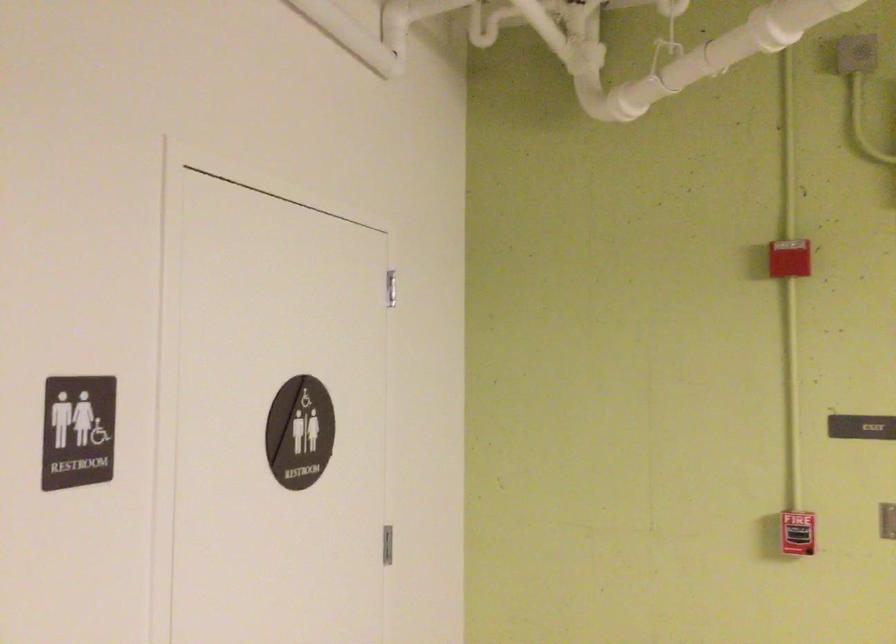
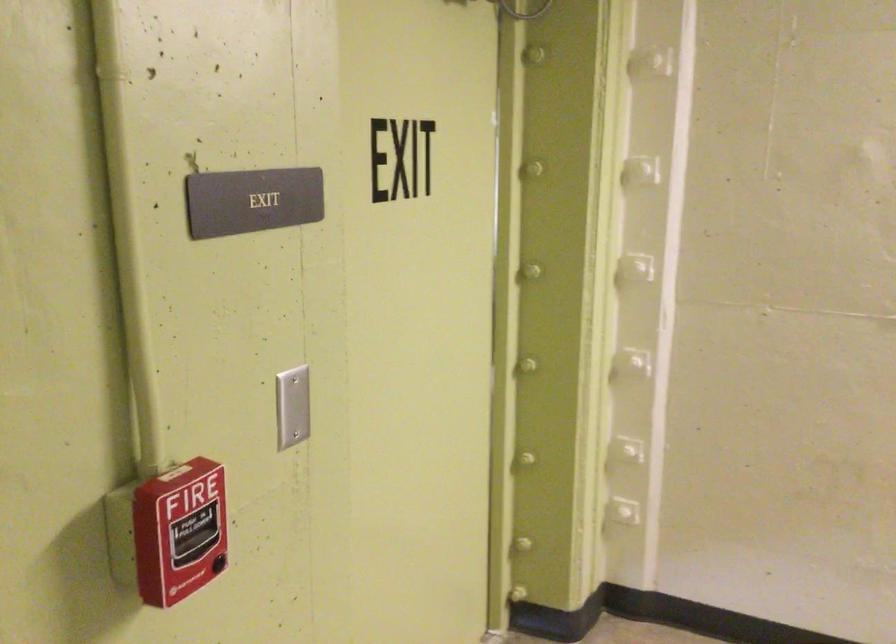
Find the pixel in the second image that matches (x=791, y=545) in the first image.

(179, 532)